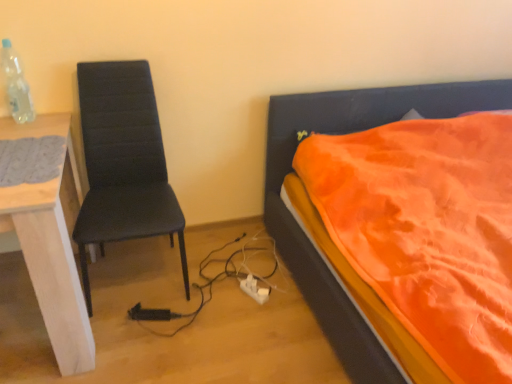
In order to click on free region under white wood desk at left (from a real-world perspective) in this screenshot , I will do `click(21, 319)`.